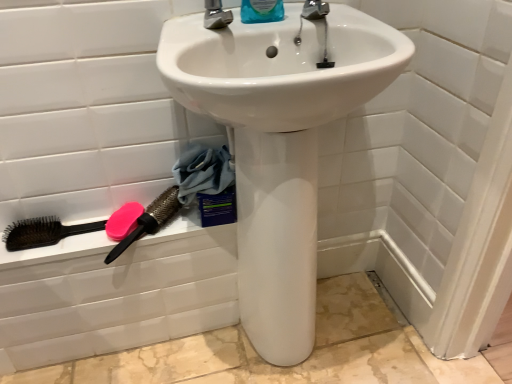
Where is `blank space situated above black plastic brush at lower left, which appears as the second brush when viewed from the right (from a real-world perspective)`? This screenshot has width=512, height=384. blank space situated above black plastic brush at lower left, which appears as the second brush when viewed from the right (from a real-world perspective) is located at coordinates (103, 222).